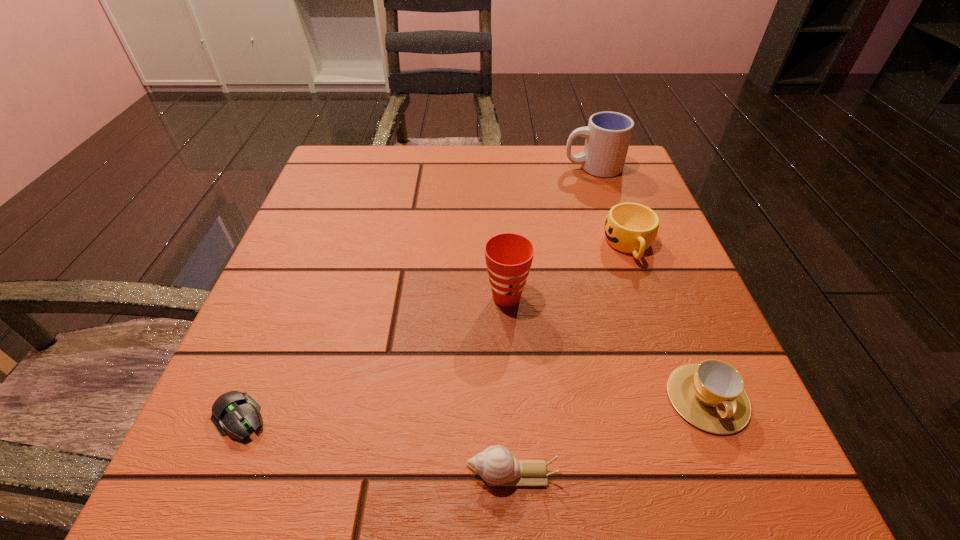
Identify the location of the farthest cup. Image resolution: width=960 pixels, height=540 pixels. (608, 134).

You are a GUI agent. You are given a task and a screenshot of the screen. Output one action in this format:
    pyautogui.click(x=<x>, y=<y>)
    Task: Click on the second nearest cup
    
    Given the screenshot: What is the action you would take?
    pyautogui.click(x=508, y=256)

You are a GUI agent. You are given a task and a screenshot of the screen. Output one action in this format:
    pyautogui.click(x=<x>, y=<y>)
    Task: Click on the leftmost cup
    The height and width of the screenshot is (540, 960).
    Given the screenshot: What is the action you would take?
    [508, 256]

Find the location of a particular element. The image size is (960, 540). the second farthest cup is located at coordinates (631, 228).

Locate an element on the screen. The height and width of the screenshot is (540, 960). the nearest cup is located at coordinates (710, 395).

You are a GUI agent. You are given a task and a screenshot of the screen. Output one action in this format:
    pyautogui.click(x=<x>, y=<y>)
    Task: Click on the escargot
    The width and height of the screenshot is (960, 540).
    Given the screenshot: What is the action you would take?
    495,465

Locate an element on the screen. The height and width of the screenshot is (540, 960). computer mouse is located at coordinates (233, 412).

I want to click on the leftmost object, so click(x=233, y=412).

The image size is (960, 540). In order to click on free space located 0.280m with the handle on the side of the farthest object in this screenshot , I will do `click(444, 167)`.

Locate an element on the screen. vacant area situated 0.330m with the handle on the side of the farthest object is located at coordinates (423, 167).